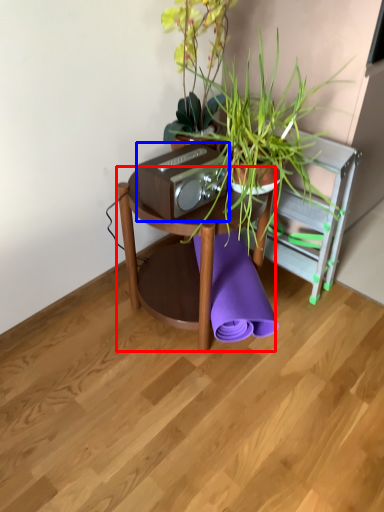
Question: Which of the following is the farthest to the observer, table (highlighted by a red box) or stereo (highlighted by a blue box)?

Choices:
 (A) table
 (B) stereo

Answer: (A)